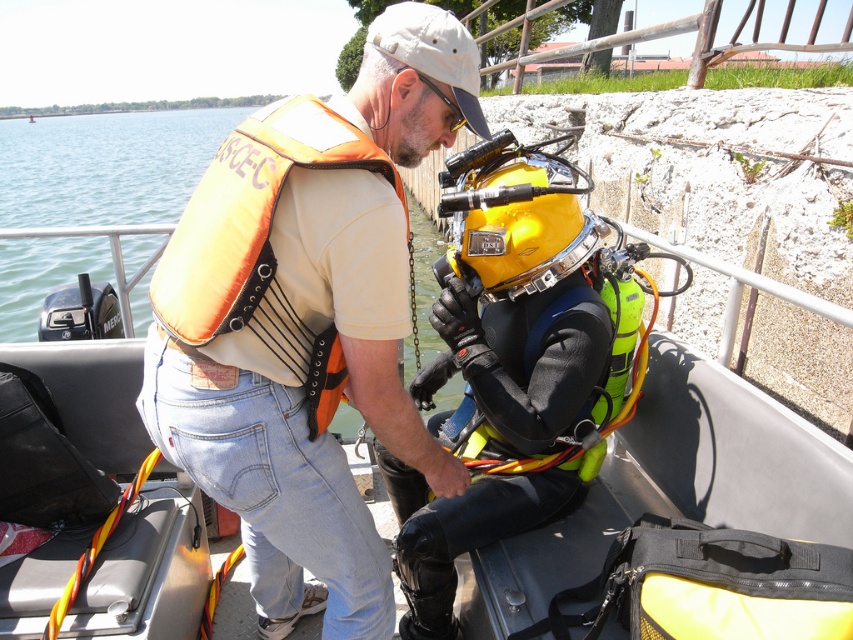
Is orange fabric life vest at center wider than metallic gray boat at center?

Yes.

Who is more forward, (316, 176) or (351, 449)?

Point (316, 176)

You are a GUI agent. You are given a task and a screenshot of the screen. Output one action in this format:
    pyautogui.click(x=<x>, y=<y>)
    Task: Click on the orange fabric life vest at center
    The image size is (853, 640).
    Given the screenshot: What is the action you would take?
    pyautogui.click(x=320, y=337)

Who is more distant from viewer, (508, 557) or (534, 248)?

The point (508, 557) is more distant.

Which of these two, metallic gray boat at center or yellow matte helmet at center, stands shorter?

With less height is metallic gray boat at center.

Identify the location of metallic gray boat at center. (674, 484).

At what (x,y) coordinates should I click in order to perform the action: click on metallic gray boat at center. Please return your answer as a coordinate pair (x, y). The image size is (853, 640). Looking at the image, I should click on (674, 484).

Which is behind, point (408, 77) or point (440, 356)?

The point (440, 356) is more distant.

Between orange fabric life vest at center and yellow matte helmet at center, which one is positioned higher?

Positioned higher is yellow matte helmet at center.

This screenshot has height=640, width=853. I want to click on orange fabric life vest at center, so [320, 337].